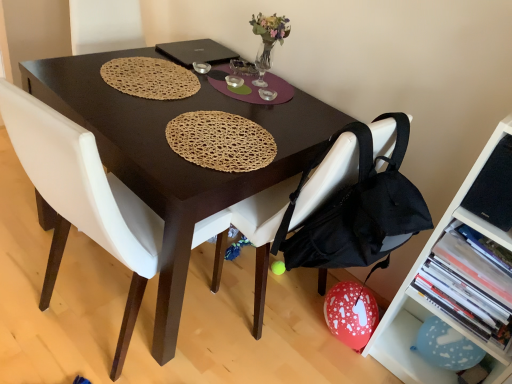
The width and height of the screenshot is (512, 384). In order to click on vacant area that lies in front of metallic silver bowl at center in this screenshot , I will do `click(195, 82)`.